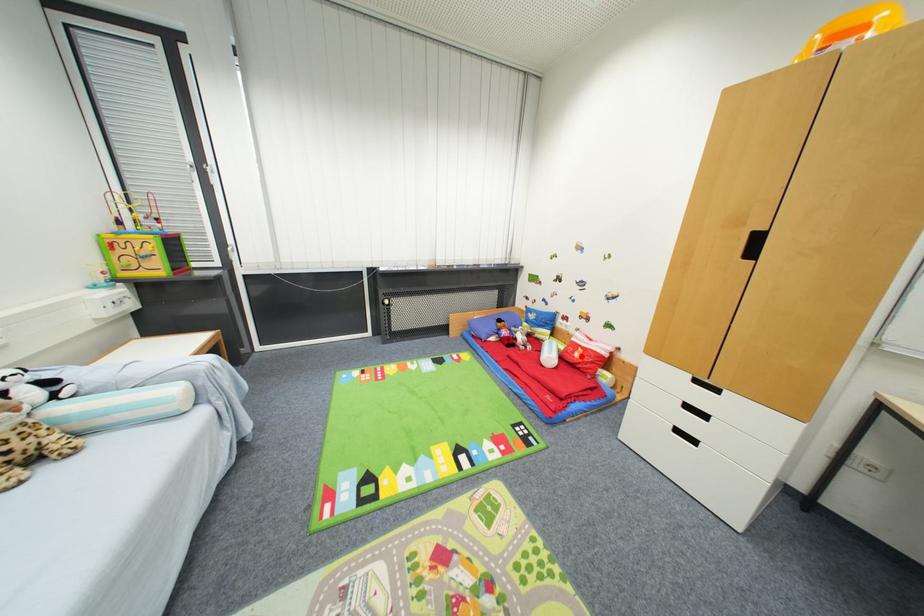
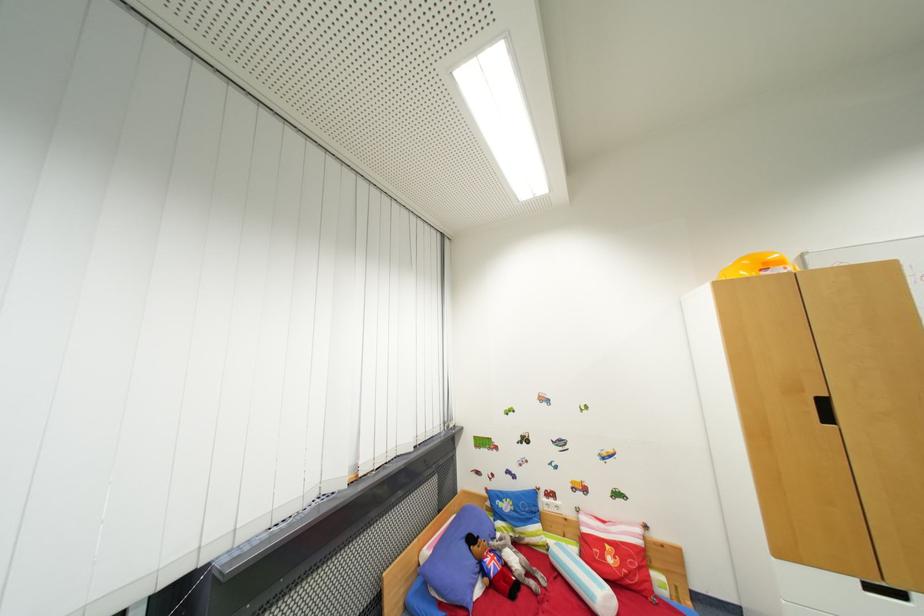
Where in the second image is the point corresponding to the highlighted location from the first image?

(614, 562)